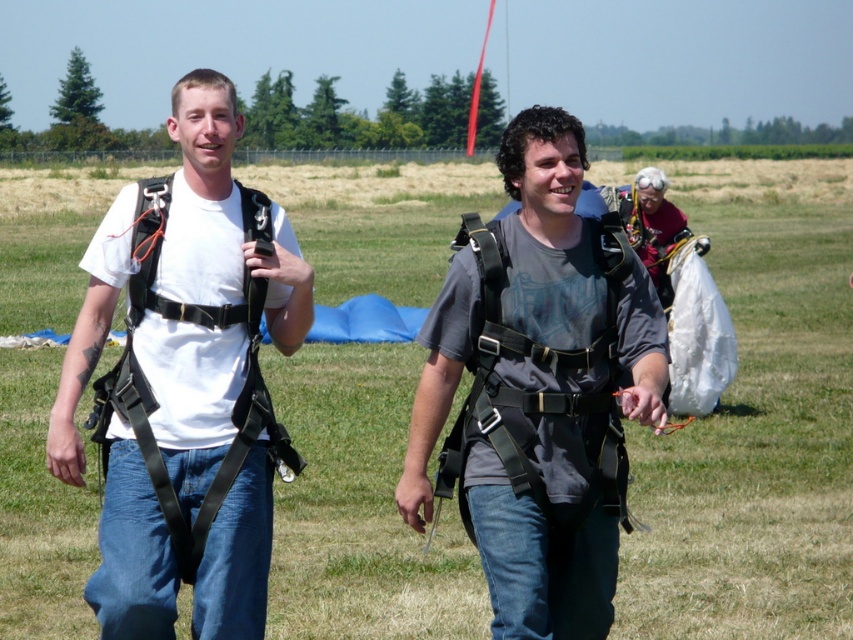
You are a photographer trying to capture a clear shot of both the black matte harness at left and the gray matte harness at center. Based on their positions, which harness will appear more in front in the photo?

The black matte harness at left will appear more in front in the photo since it is positioned over the gray matte harness at center.

You are standing at the point labeled point [582,170] and want to move towards the camera. Which direction should you go to reach the point labeled point [138,560]?

The point labeled point [138,560] is in front of the point labeled point [582,170], so you should move forward towards it to reach the desired location.